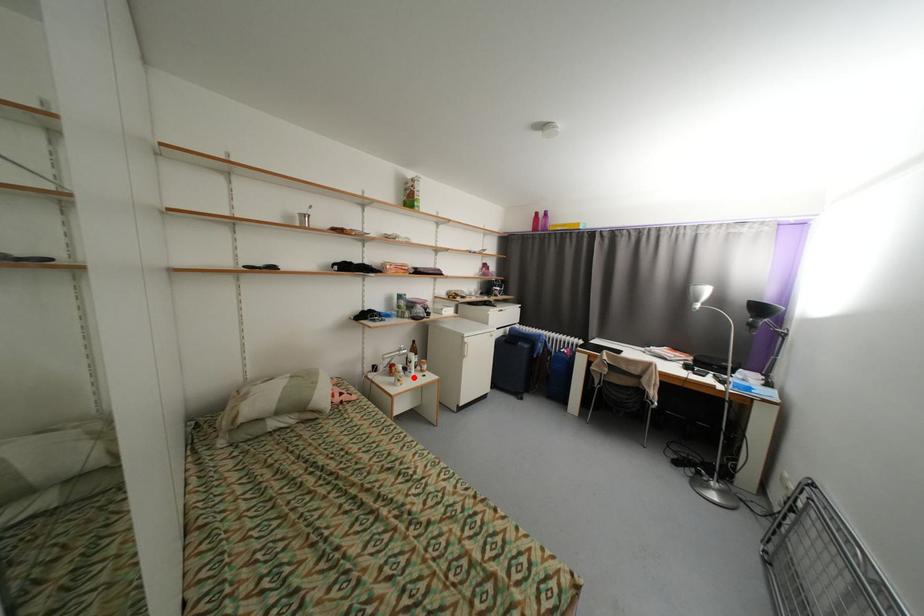
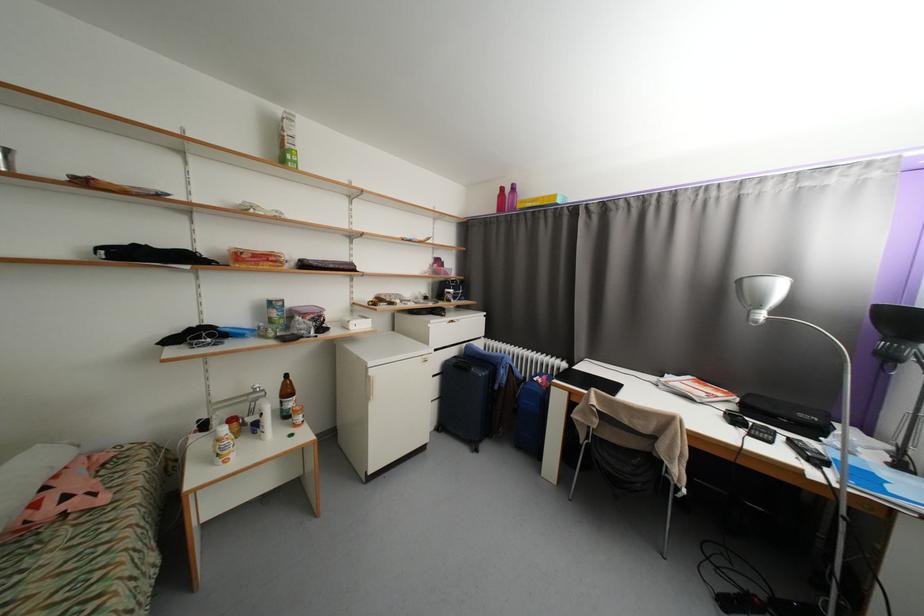
Question: I am providing you with two images of the same scene from different viewpoints. Given a red point in image1, look at the same physical point in image2. Is it:

Choices:
 (A) Closer to the viewpoint
 (B) Farther from the viewpoint

Answer: (A)